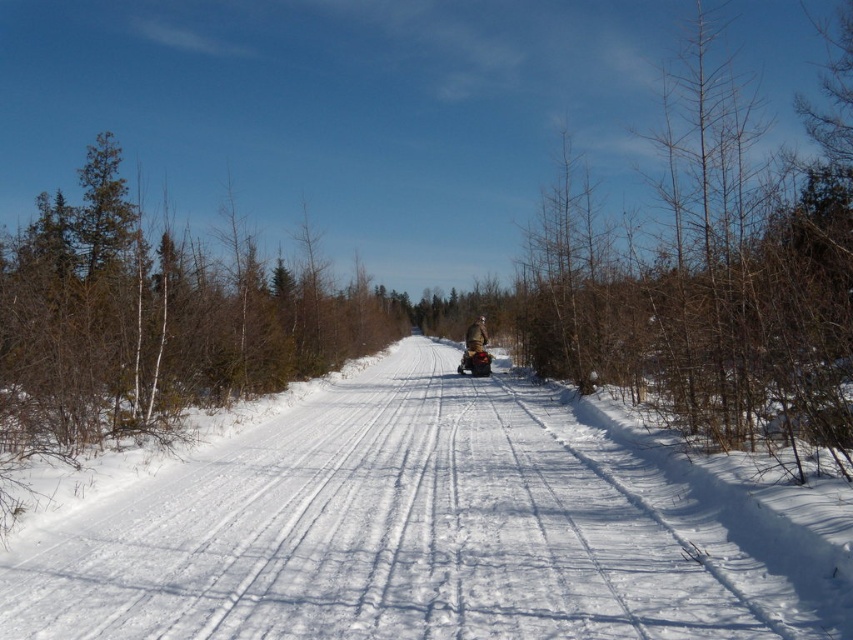
Question: Does white snow trail at center appear under matte black snowmobile at center?

Choices:
 (A) no
 (B) yes

Answer: (B)

Question: Does bare branches at right have a greater width compared to brown fuzzy jacket at center?

Choices:
 (A) yes
 (B) no

Answer: (A)

Question: Which object is closer to the camera taking this photo?

Choices:
 (A) brown fuzzy jacket at center
 (B) bare branches at right
 (C) white snow trail at center
 (D) matte black snowmobile at center

Answer: (C)

Question: Is white snow trail at center to the left of brown fuzzy jacket at center from the viewer's perspective?

Choices:
 (A) yes
 (B) no

Answer: (A)

Question: Which point is farther to the camera?

Choices:
 (A) bare branches at right
 (B) brown fuzzy jacket at center
 (C) white snow trail at center

Answer: (B)

Question: Considering the real-world distances, which object is farthest from the brown fuzzy jacket at center?

Choices:
 (A) white snow trail at center
 (B) matte black snowmobile at center

Answer: (A)